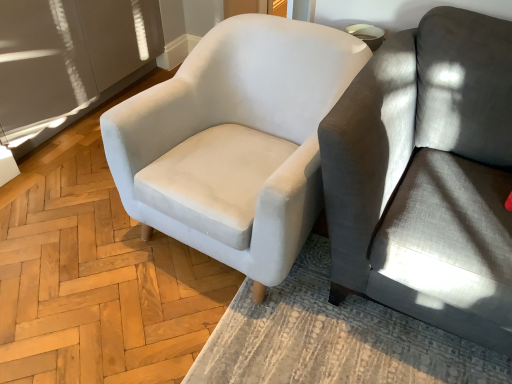
Question: Is white fabric chair at center at the right side of gray fabric couch at right?

Choices:
 (A) yes
 (B) no

Answer: (B)

Question: From the image's perspective, is white fabric chair at center located beneath gray fabric couch at right?

Choices:
 (A) yes
 (B) no

Answer: (B)

Question: Would you consider white fabric chair at center to be distant from gray fabric couch at right?

Choices:
 (A) no
 (B) yes

Answer: (A)

Question: Considering the relative positions of white fabric chair at center and gray fabric couch at right in the image provided, is white fabric chair at center in front of gray fabric couch at right?

Choices:
 (A) no
 (B) yes

Answer: (A)

Question: Can gray fabric couch at right be found inside white fabric chair at center?

Choices:
 (A) no
 (B) yes

Answer: (A)

Question: Does white fabric chair at center come behind gray fabric couch at right?

Choices:
 (A) yes
 (B) no

Answer: (A)

Question: From a real-world perspective, is gray fabric couch at right over white fabric chair at center?

Choices:
 (A) no
 (B) yes

Answer: (B)

Question: Is gray fabric couch at right closer to the viewer compared to white fabric chair at center?

Choices:
 (A) yes
 (B) no

Answer: (A)

Question: Considering the relative positions of gray fabric couch at right and white fabric chair at center in the image provided, is gray fabric couch at right to the right of white fabric chair at center from the viewer's perspective?

Choices:
 (A) yes
 (B) no

Answer: (A)

Question: Does gray fabric couch at right touch white fabric chair at center?

Choices:
 (A) yes
 (B) no

Answer: (B)

Question: Is gray fabric couch at right smaller than white fabric chair at center?

Choices:
 (A) yes
 (B) no

Answer: (B)

Question: Is gray fabric couch at right shorter than white fabric chair at center?

Choices:
 (A) no
 (B) yes

Answer: (A)

Question: In the image, is white fabric chair at center positioned in front of or behind gray fabric couch at right?

Choices:
 (A) behind
 (B) front

Answer: (A)